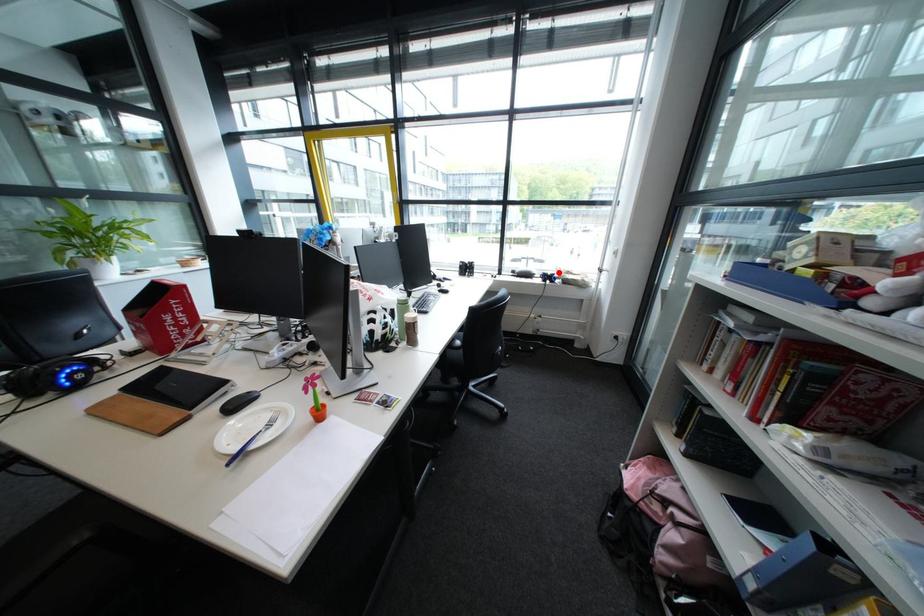
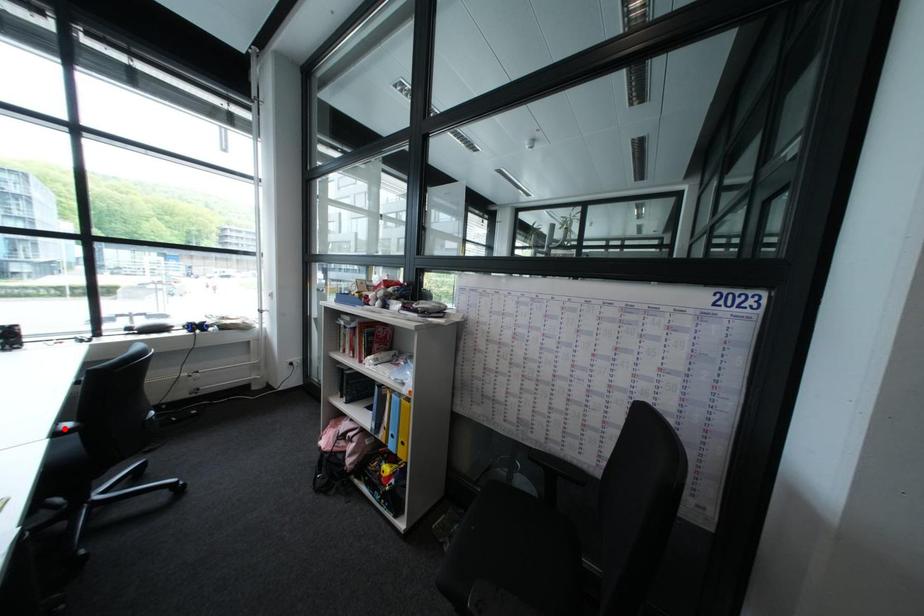
From the picture: I am providing you with two images of the same scene from different viewpoints. A red point is marked on the first image and another point is marked on the second image. Is the red point in image1 aligned with the point shown in image2?

No